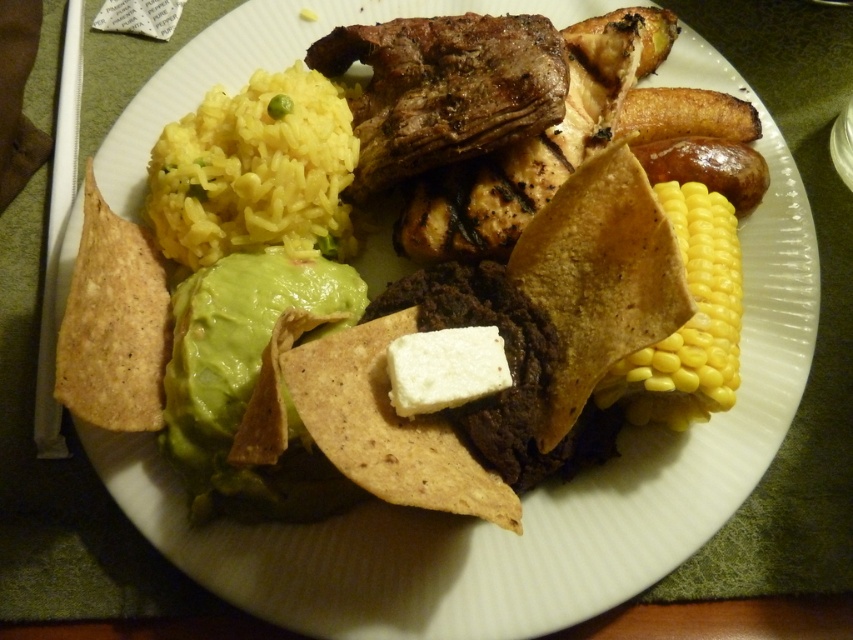
Question: Where is green creamy guacamole at center located in relation to yellow/yellowish rice at upper left in the image?

Choices:
 (A) right
 (B) left

Answer: (A)

Question: Which object appears farthest from the camera in this image?

Choices:
 (A) green creamy guacamole at center
 (B) white creamy cheese at center
 (C) yellow/yellowish rice at upper left
 (D) grilled brown meat at center

Answer: (D)

Question: Does green creamy guacamole at center have a greater width compared to yellow/yellowish rice at upper left?

Choices:
 (A) yes
 (B) no

Answer: (B)

Question: Is grilled brown meat at center to the right of yellow matte corn at right from the viewer's perspective?

Choices:
 (A) yes
 (B) no

Answer: (B)

Question: Considering the real-world distances, which object is farthest from the grilled brown meat at center?

Choices:
 (A) yellow matte corn at right
 (B) green creamy guacamole at center
 (C) yellow/yellowish rice at upper left

Answer: (A)

Question: Which of these objects is positioned farthest from the green creamy guacamole at center?

Choices:
 (A) yellow matte corn at right
 (B) grilled brown meat at center
 (C) white creamy cheese at center

Answer: (A)